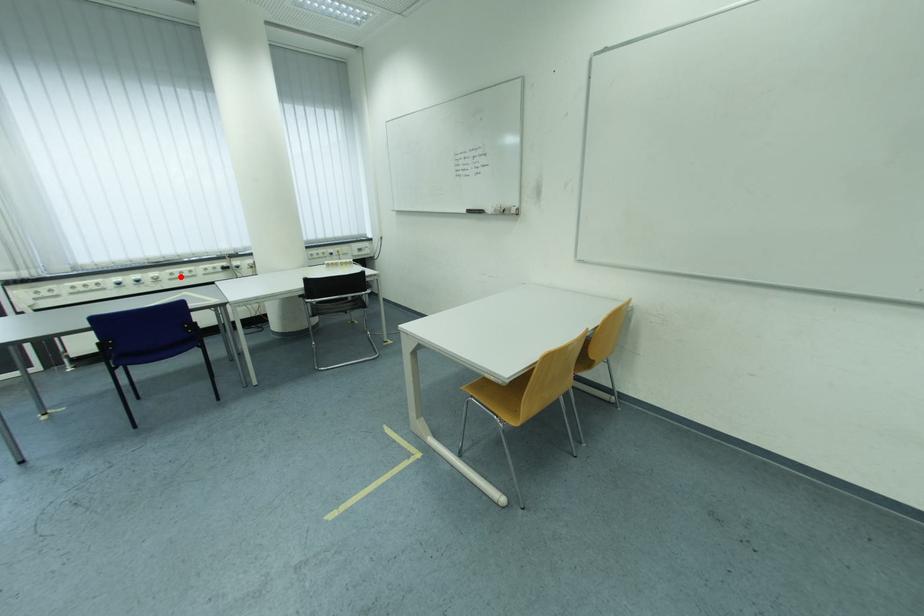
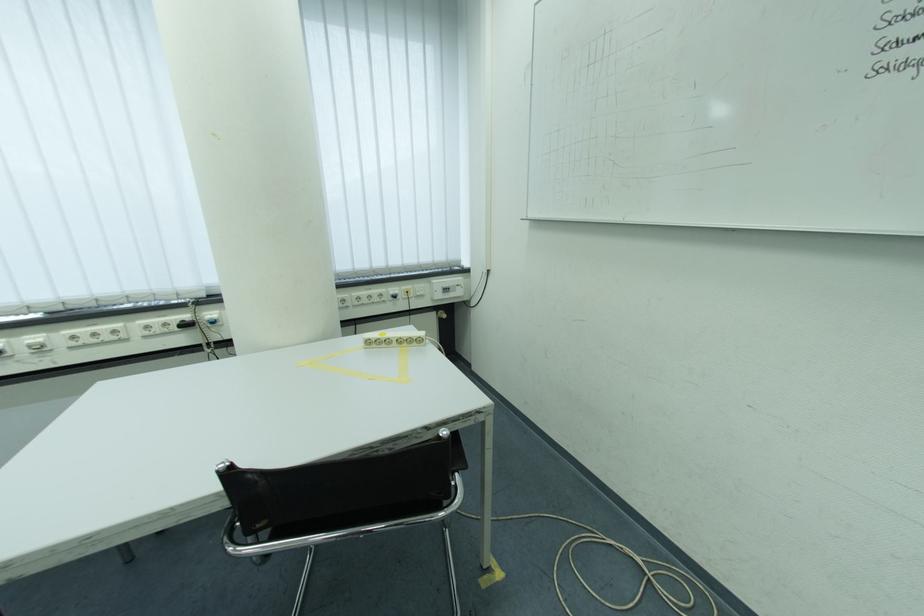
Where in the second image is the point corresponding to the highlighted location from the first image?

(82, 339)